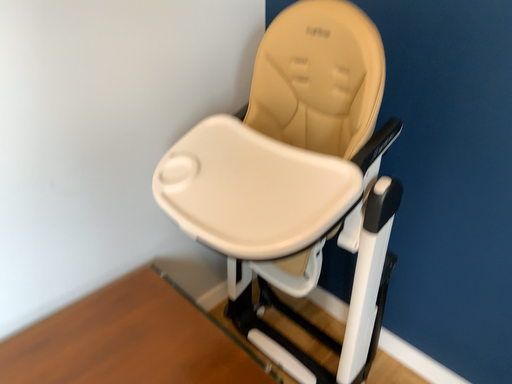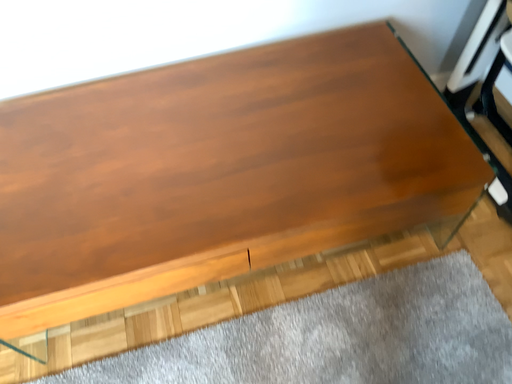
Question: How did the camera likely rotate when shooting the video?

Choices:
 (A) rotated downward
 (B) rotated upward

Answer: (A)